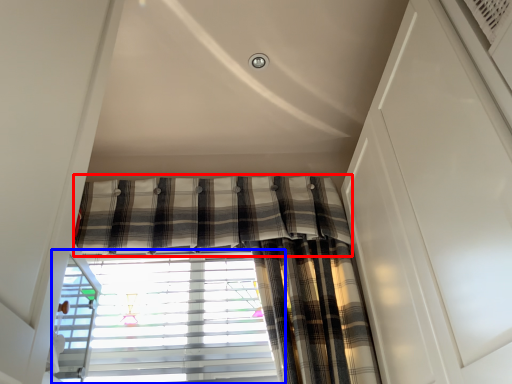
Question: Which of the following is the farthest to the observer, curtain (highlighted by a red box) or window blind (highlighted by a blue box)?

Choices:
 (A) curtain
 (B) window blind

Answer: (A)